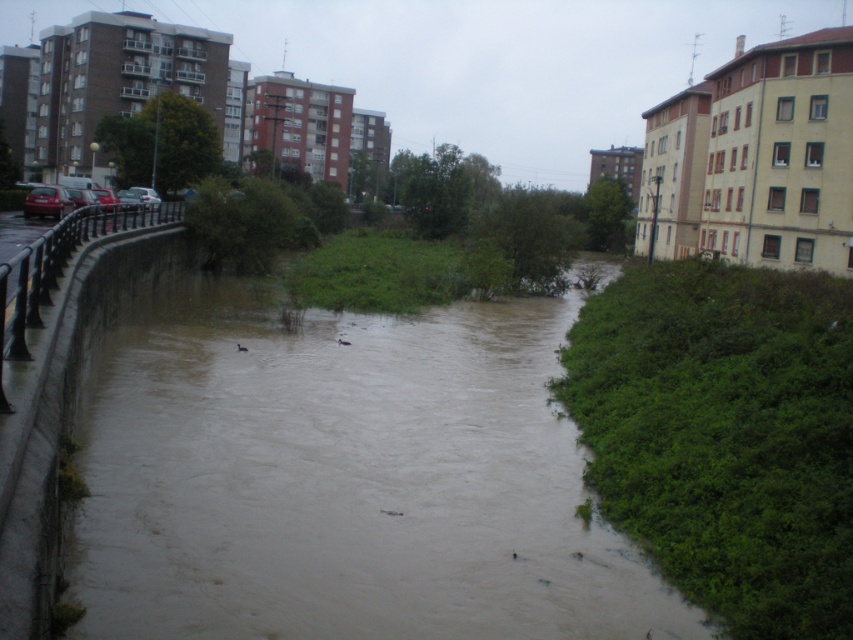
You are a rescue worker trying to reach a stranded resident on the other side of the flooded area. You see the brown muddy water at center and the shiny red car at left. Which object is higher in elevation, and why?

The brown muddy water at center has a greater height compared to the shiny red car at left, meaning the water is higher than the car, making the car submerged or partially submerged.

You are a rescue worker trying to reach a stranded resident in the flooded area. You see the brown muddy water at center and the shiny red car at left. Which object is closer to the ground level? Please explain your reasoning based on their positions.

The brown muddy water at center is positioned under the shiny red car at left, meaning the water is lower than the car. Therefore, the brown muddy water at center is closer to the ground level than the shiny red car at left.